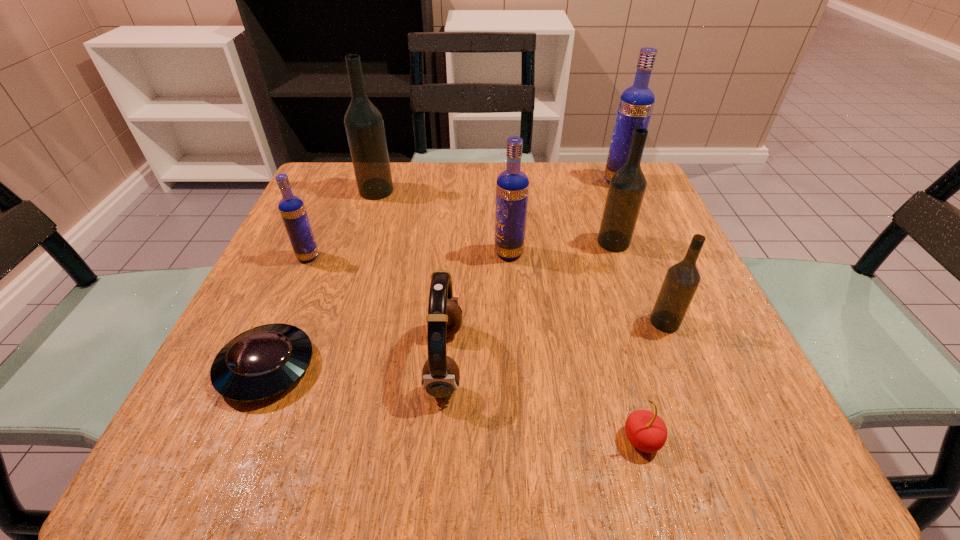
Point out which blue vodka is positioned as the second nearest to the biggest black vodka. Please provide its 2D coordinates. Your answer should be formatted as a tuple, i.e. [(x, y)], where the tuple contains the x and y coordinates of a point satisfying the conditions above.

[(512, 186)]

Locate which black vodka ranks in proximity to the leftmost blue vodka. Please provide its 2D coordinates. Your answer should be formatted as a tuple, i.e. [(x, y)], where the tuple contains the x and y coordinates of a point satisfying the conditions above.

[(364, 125)]

Where is `black vodka that stands as the third closest to the red cherry`? Image resolution: width=960 pixels, height=540 pixels. black vodka that stands as the third closest to the red cherry is located at coordinates (364, 125).

The width and height of the screenshot is (960, 540). I want to click on vacant area that satisfies the following two spatial constraints: 1. on the back side of the farthest blue vodka; 2. on the left side of the second smallest black vodka, so click(x=592, y=181).

Where is `vacant area in the image that satisfies the following two spatial constraints: 1. on the back side of the nearest vodka; 2. on the left side of the cherry`? This screenshot has height=540, width=960. vacant area in the image that satisfies the following two spatial constraints: 1. on the back side of the nearest vodka; 2. on the left side of the cherry is located at coordinates (609, 322).